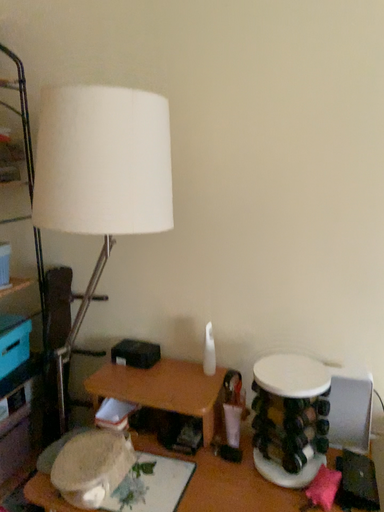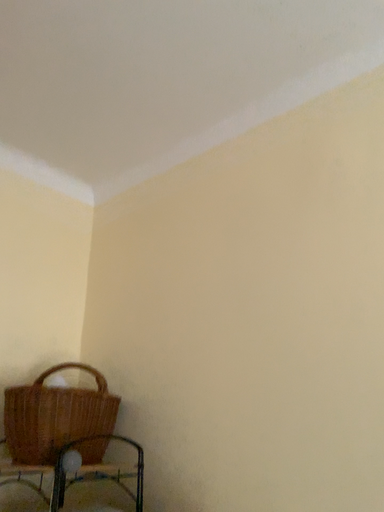
Question: How did the camera likely rotate when shooting the video?

Choices:
 (A) rotated upward
 (B) rotated downward

Answer: (A)